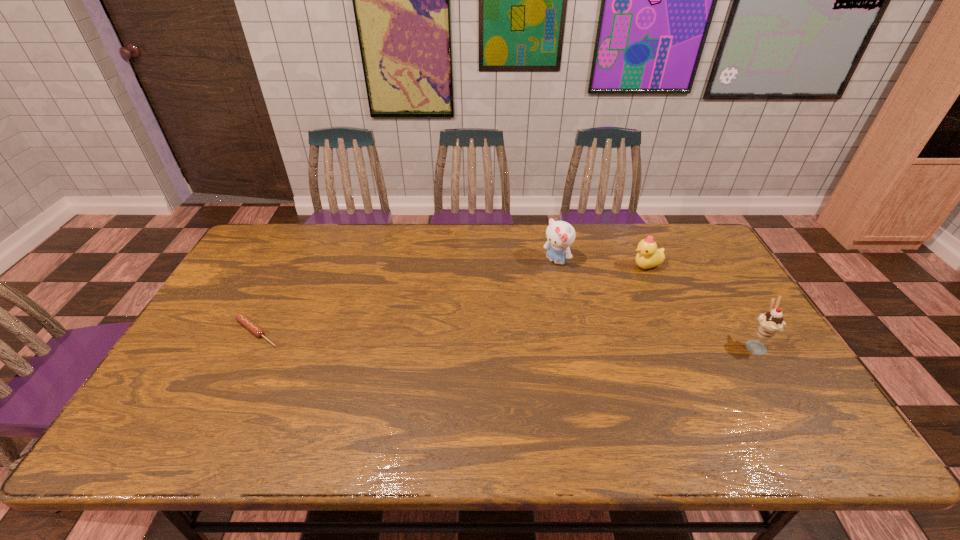
Where is `vacant space at the left edge`? This screenshot has width=960, height=540. vacant space at the left edge is located at coordinates pyautogui.click(x=208, y=321).

Find the location of `vacant position at the right edge of the desktop`. vacant position at the right edge of the desktop is located at coordinates (715, 282).

What are the coordinates of `vacant space at the far right corner` in the screenshot? It's located at (675, 258).

Identify the location of free space between the sausage and the icecream. The width and height of the screenshot is (960, 540). (506, 339).

At what (x,y) coordinates should I click in order to perform the action: click on free area in between the second object from left to right and the leftmost object. Please return your answer as a coordinate pair (x, y). This screenshot has width=960, height=540. Looking at the image, I should click on (406, 297).

At what (x,y) coordinates should I click in order to perform the action: click on vacant area between the kitten and the rightmost object. Please return your answer as a coordinate pair (x, y). The height and width of the screenshot is (540, 960). Looking at the image, I should click on (655, 303).

In order to click on vacant space in between the rightmost object and the shortest object in this screenshot , I will do `click(506, 339)`.

The height and width of the screenshot is (540, 960). Identify the location of vacant point located between the rightmost object and the leftmost object. (506, 339).

The image size is (960, 540). Find the location of `free space between the second object from right to left and the leftmost object`. free space between the second object from right to left and the leftmost object is located at coordinates (451, 299).

Find the location of a particular element. The image size is (960, 540). free area in between the second shortest object and the third object from right to left is located at coordinates (600, 264).